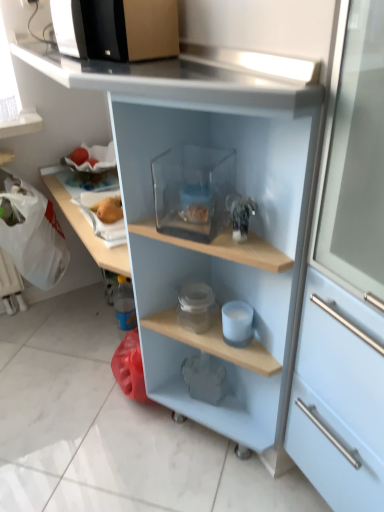
Question: Can you see matte gray elephant at lower center, the 1th appliance in the bottom-to-top sequence, touching white matte cup at center, which is the 2th appliance in bottom-to-top order?

Choices:
 (A) no
 (B) yes

Answer: (A)

Question: Is matte gray elephant at lower center, which is counted as the 1th appliance, starting from the back, completely or partially outside of white matte cup at center, arranged as the second appliance when viewed from the top?

Choices:
 (A) no
 (B) yes

Answer: (B)

Question: Does matte gray elephant at lower center, which ranks as the third appliance in front-to-back order, appear on the left side of white matte cup at center, arranged as the second appliance when viewed from the top?

Choices:
 (A) yes
 (B) no

Answer: (A)

Question: Can you confirm if matte gray elephant at lower center, the 1th appliance in the bottom-to-top sequence, is positioned to the right of white matte cup at center, arranged as the second appliance when viewed from the top?

Choices:
 (A) yes
 (B) no

Answer: (B)

Question: From the image's perspective, is matte gray elephant at lower center, which is the third appliance in top-to-bottom order, beneath white matte cup at center, which is the 2th appliance in bottom-to-top order?

Choices:
 (A) no
 (B) yes

Answer: (B)

Question: Is matte gray elephant at lower center, which ranks as the third appliance in front-to-back order, smaller than white matte cup at center, the second appliance viewed from the back?

Choices:
 (A) yes
 (B) no

Answer: (B)

Question: From a real-world perspective, is yellow matte apple at upper left positioned over matte gray elephant at lower center, the 1th appliance in the bottom-to-top sequence, based on gravity?

Choices:
 (A) yes
 (B) no

Answer: (A)

Question: Does yellow matte apple at upper left have a lesser height compared to matte gray elephant at lower center, which ranks as the third appliance in front-to-back order?

Choices:
 (A) yes
 (B) no

Answer: (A)

Question: Is the depth of yellow matte apple at upper left less than that of matte gray elephant at lower center, the 1th appliance in the bottom-to-top sequence?

Choices:
 (A) yes
 (B) no

Answer: (B)

Question: Is matte gray elephant at lower center, which ranks as the third appliance in front-to-back order, a part of yellow matte apple at upper left?

Choices:
 (A) yes
 (B) no

Answer: (B)

Question: From the image's perspective, is yellow matte apple at upper left beneath matte gray elephant at lower center, which is counted as the 1th appliance, starting from the back?

Choices:
 (A) no
 (B) yes

Answer: (A)

Question: Can you confirm if yellow matte apple at upper left is positioned to the left of matte gray elephant at lower center, the 1th appliance in the bottom-to-top sequence?

Choices:
 (A) no
 (B) yes

Answer: (B)

Question: From a real-world perspective, is yellow matte apple at upper left positioned under transparent plastic container at center based on gravity?

Choices:
 (A) yes
 (B) no

Answer: (B)